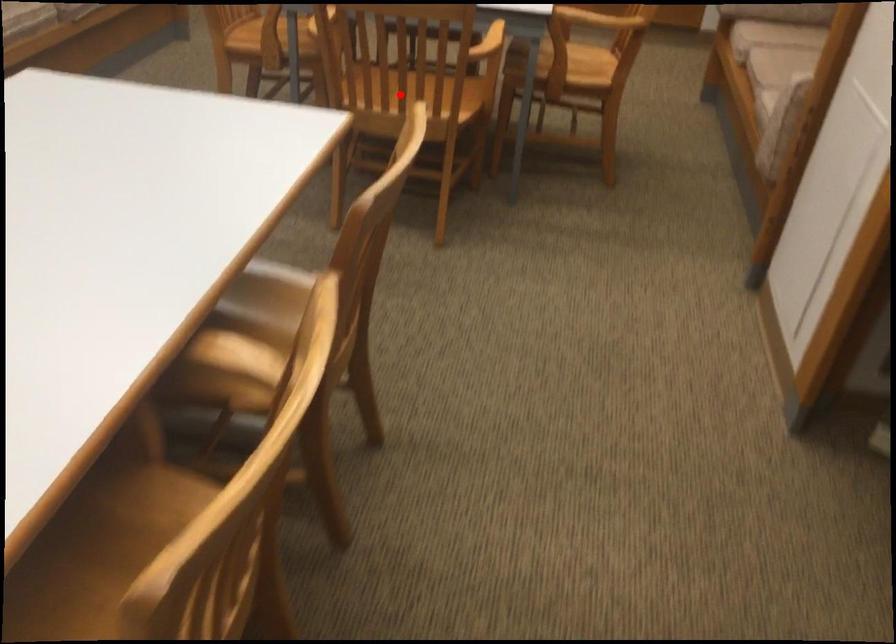
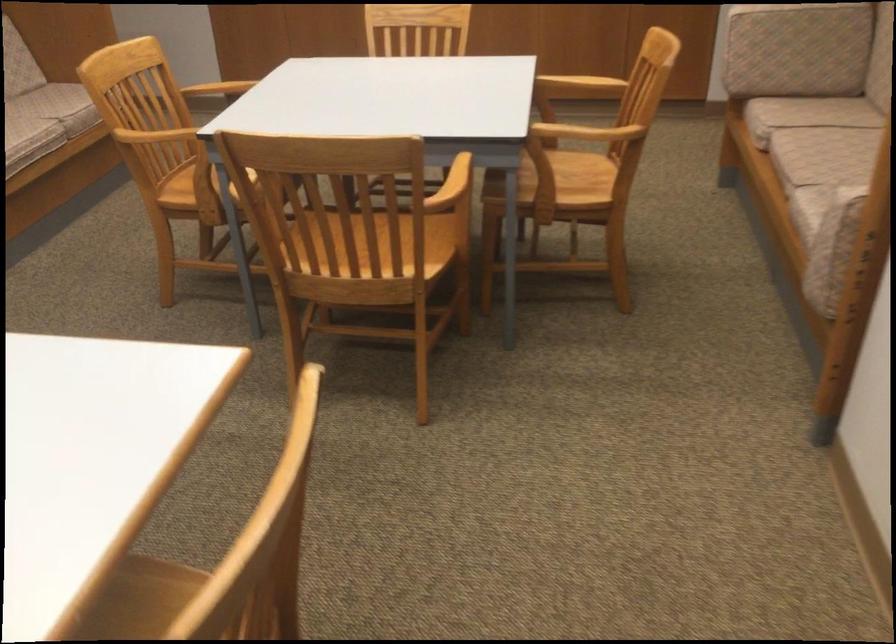
Question: I am providing you with two images of the same scene from different viewpoints. Given a red point in image1, look at the same physical point in image2. Is it:

Choices:
 (A) Closer to the viewpoint
 (B) Farther from the viewpoint

Answer: (A)